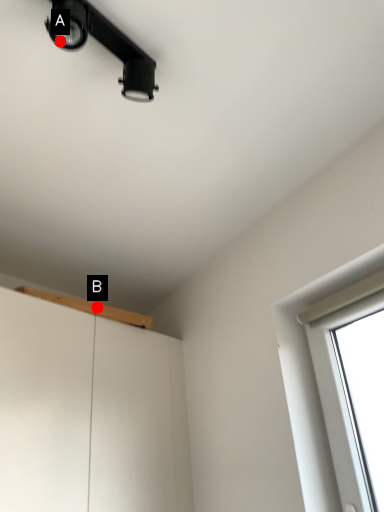
Question: Two points are circled on the image, labeled by A and B beside each circle. Among these points, which one is nearest to the camera?

Choices:
 (A) A is closer
 (B) B is closer

Answer: (A)